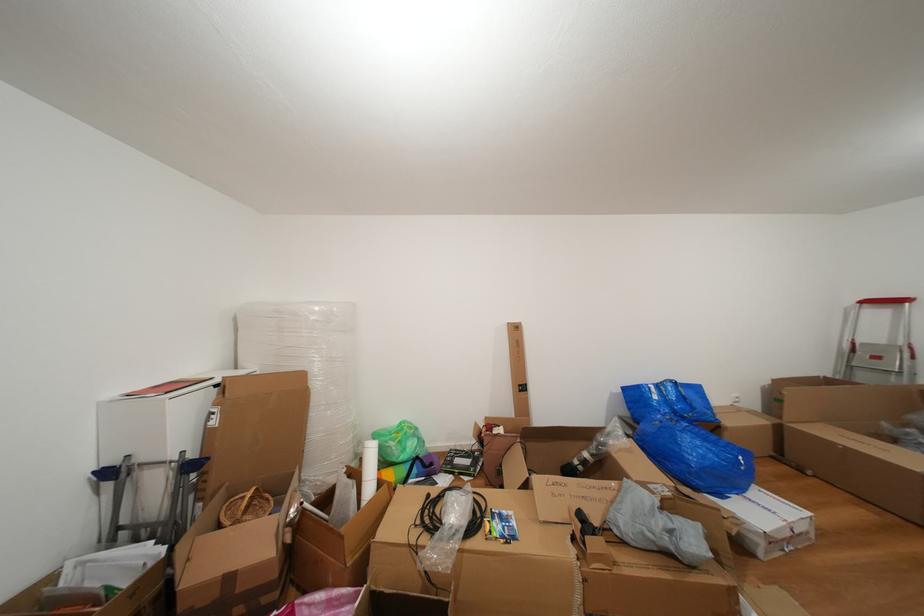
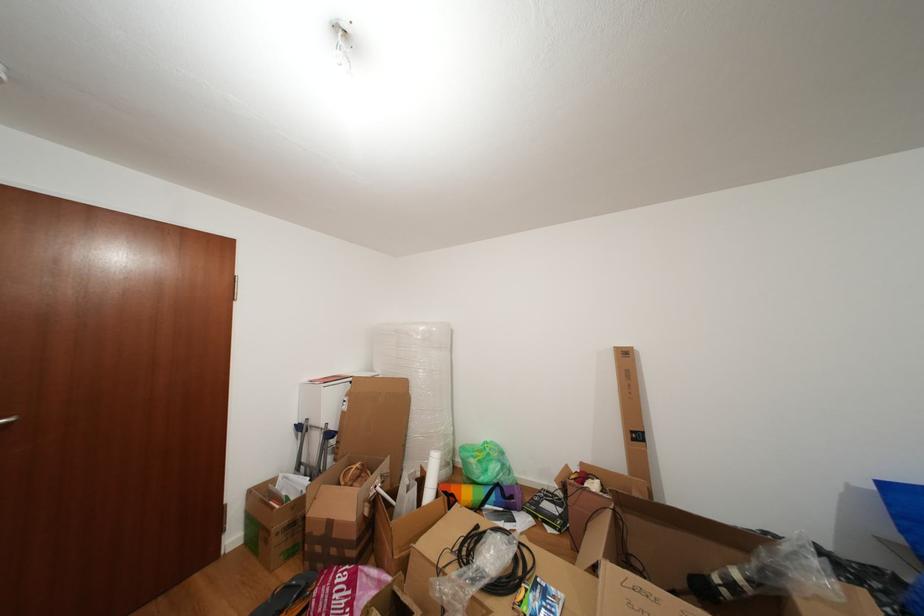
In the second image, find the point that corresponds to the point at 248,519 in the first image.

(357, 485)